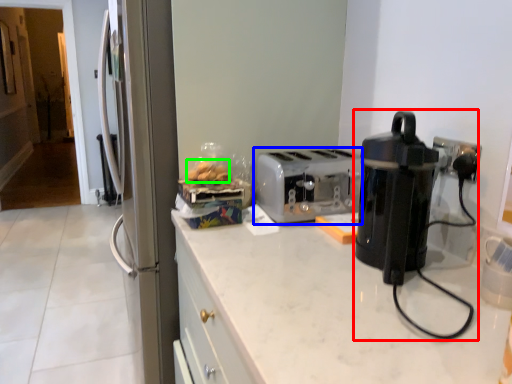
Question: Which is farther away from home appliance (highlighted by a red box)? toaster (highlighted by a blue box) or food (highlighted by a green box)?

Choices:
 (A) toaster
 (B) food

Answer: (B)